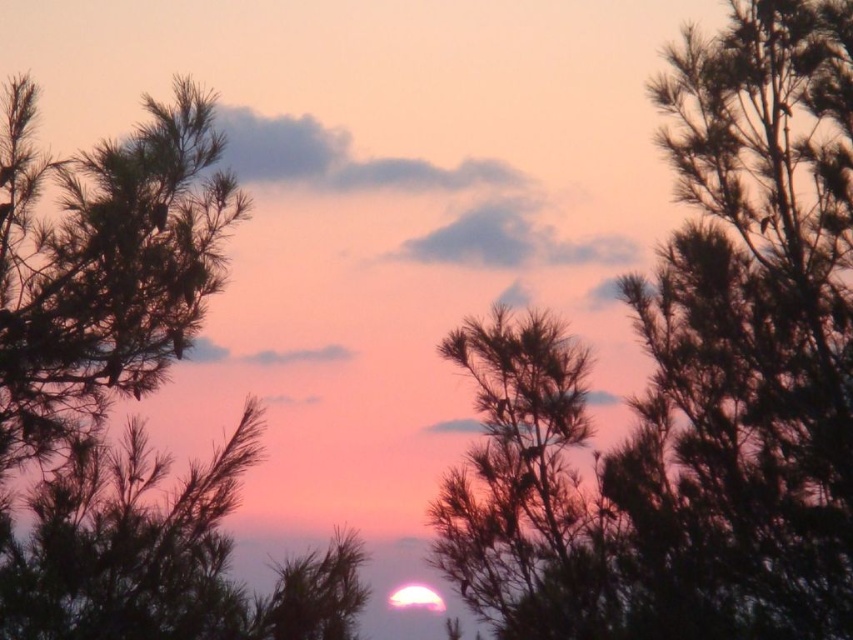
Question: Which object is positioned closest to the silky dark green foliage at center?

Choices:
 (A) silvery metallic tree at center
 (B) silky dark green tree at center

Answer: (B)

Question: Can you confirm if silky dark green tree at center is wider than green matte tree at center?

Choices:
 (A) no
 (B) yes

Answer: (B)

Question: Is silky dark green tree at center positioned at the back of silvery metallic tree at center?

Choices:
 (A) yes
 (B) no

Answer: (B)

Question: Which object is positioned farthest from the silky dark green tree at center?

Choices:
 (A) silvery metallic tree at center
 (B) silky dark green foliage at center
 (C) green matte tree at center

Answer: (C)

Question: Can you confirm if silky dark green tree at center is positioned to the left of silvery metallic tree at center?

Choices:
 (A) no
 (B) yes

Answer: (A)

Question: Which of the following is the closest to the observer?

Choices:
 (A) silky dark green tree at center
 (B) green matte tree at center
 (C) silky dark green foliage at center

Answer: (C)